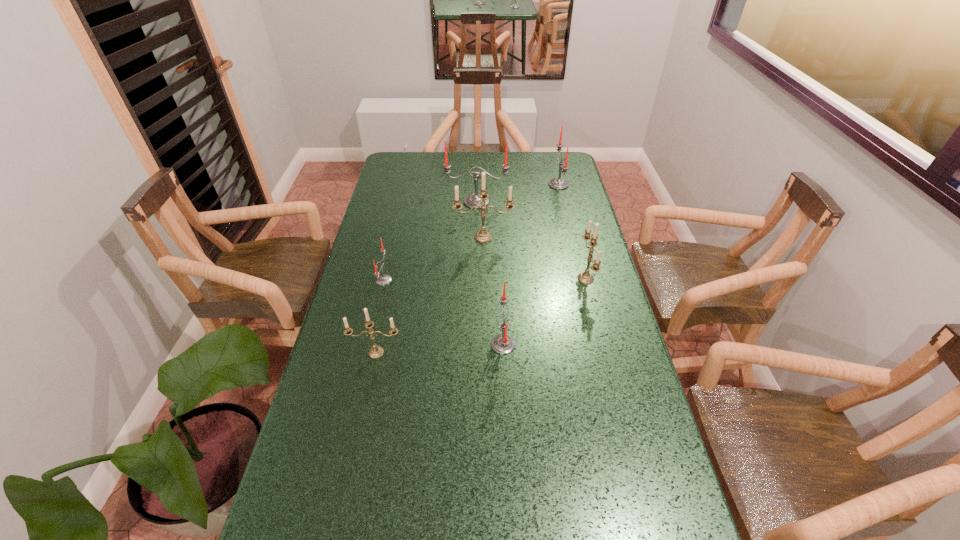
Identify the location of the biggest red candle. Image resolution: width=960 pixels, height=540 pixels. (471, 200).

You are a GUI agent. You are given a task and a screenshot of the screen. Output one action in this format:
    pyautogui.click(x=<x>, y=<y>)
    Task: Click on the farthest metallic candle
    
    Given the screenshot: What is the action you would take?
    pyautogui.click(x=483, y=236)

Where is `the fifth nearest object`? This screenshot has width=960, height=540. the fifth nearest object is located at coordinates (483, 236).

Identify the location of the second biggest red candle. (558, 183).

You are a GUI agent. You are given a task and a screenshot of the screen. Output one action in this format:
    pyautogui.click(x=<x>, y=<y>)
    Task: Click on the rightmost metallic candle
    
    Given the screenshot: What is the action you would take?
    coord(585,277)

Locate an element on the screen. the second smallest metallic candle is located at coordinates (585, 277).

I want to click on the second smallest red candle, so click(x=503, y=344).

Locate an element on the screen. The width and height of the screenshot is (960, 540). the nearest metallic candle is located at coordinates (375, 352).

At what (x,y) coordinates should I click in order to perform the action: click on the smallest metallic candle. Please return your answer as a coordinate pair (x, y). The image size is (960, 540). Looking at the image, I should click on (375, 352).

Find the location of `the second nearest red candle`. the second nearest red candle is located at coordinates (383, 279).